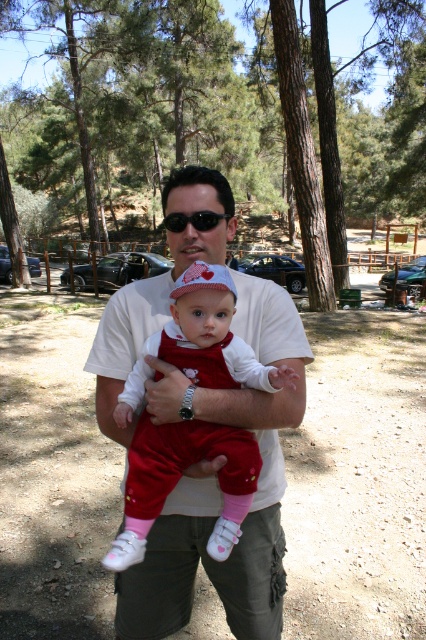
Can you confirm if matte white hand at center is positioned below white matte hand at center?

No, matte white hand at center is not below white matte hand at center.

Can you confirm if matte white hand at center is bigger than white matte hand at center?

Yes, matte white hand at center is bigger than white matte hand at center.

Does point (166, 372) come closer to viewer compared to point (124, 410)?

Yes, it is.

Locate an element on the screen. The width and height of the screenshot is (426, 640). matte white hand at center is located at coordinates (164, 392).

Is matte red onesie at center to the right of white matte skin at center from the viewer's perspective?

No, matte red onesie at center is not to the right of white matte skin at center.

Is point (210, 314) closer to viewer compared to point (279, 376)?

No, it is behind (279, 376).

You are a GUI agent. You are given a task and a screenshot of the screen. Output one action in this format:
    pyautogui.click(x=<x>, y=<y>)
    Task: Click on the matte red onesie at center
    
    Given the screenshot: What is the action you would take?
    pyautogui.click(x=180, y=477)

Where is `matte red onesie at center`? Image resolution: width=426 pixels, height=640 pixels. matte red onesie at center is located at coordinates (180, 477).

Is point (212, 428) behind point (152, 408)?

Yes, it is behind point (152, 408).

Which is in front, point (238, 458) or point (175, 388)?

Point (175, 388) is more forward.

Image resolution: width=426 pixels, height=640 pixels. In order to click on matte red onesie at center in this screenshot , I will do `click(180, 477)`.